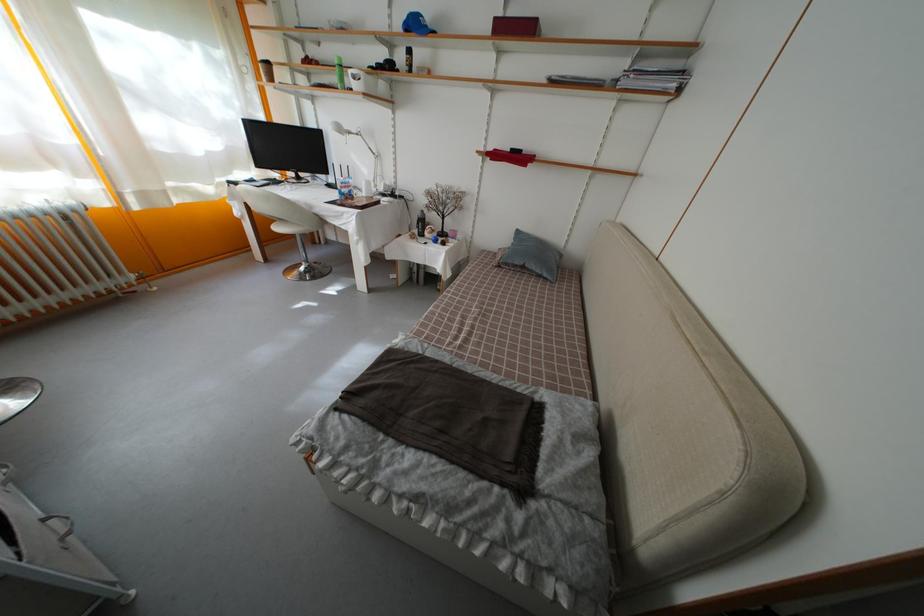
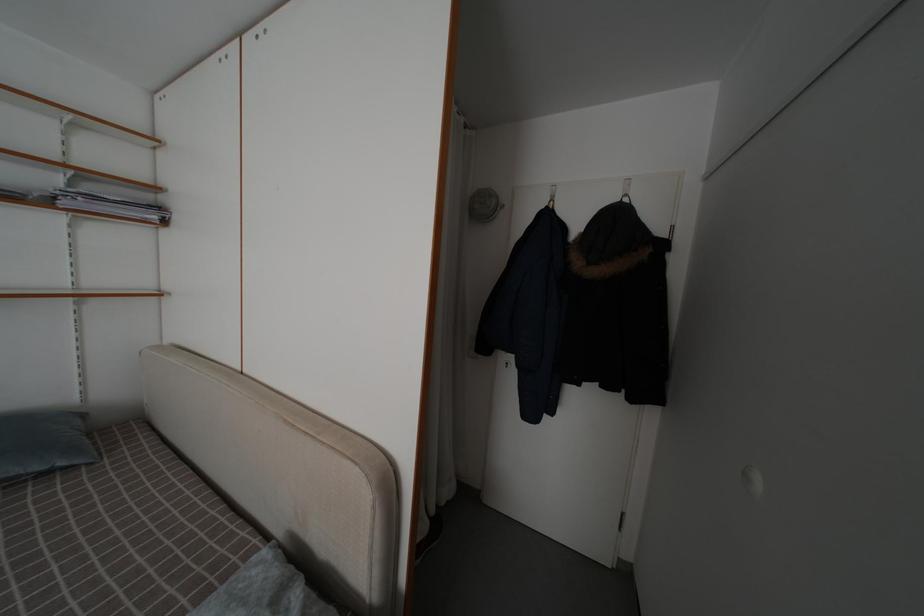
Question: The camera is either moving clockwise (left) or counter-clockwise (right) around the object. The first image is from the beginning of the video and the second image is from the end. Is the camera moving left or right when shooting the video?

Choices:
 (A) Left
 (B) Right

Answer: (A)